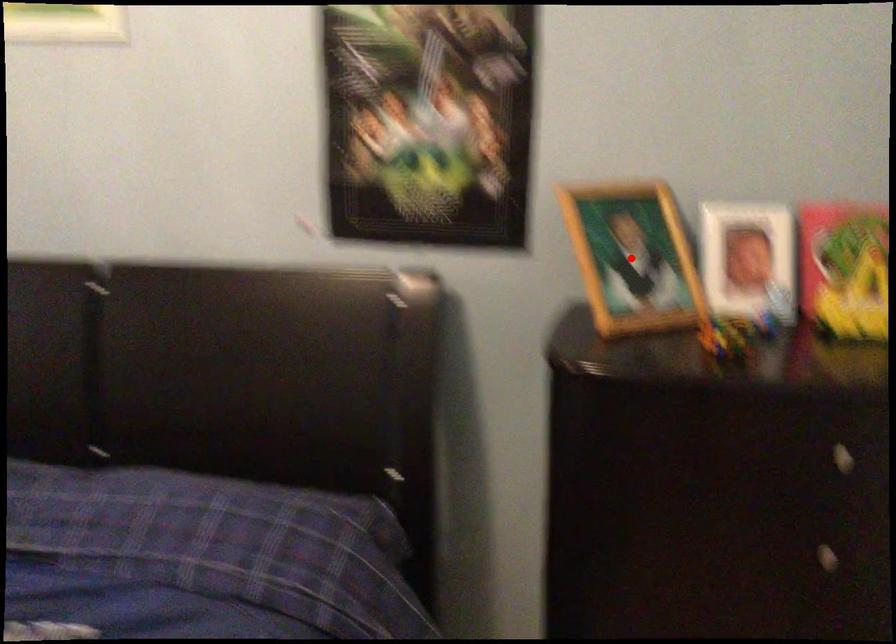
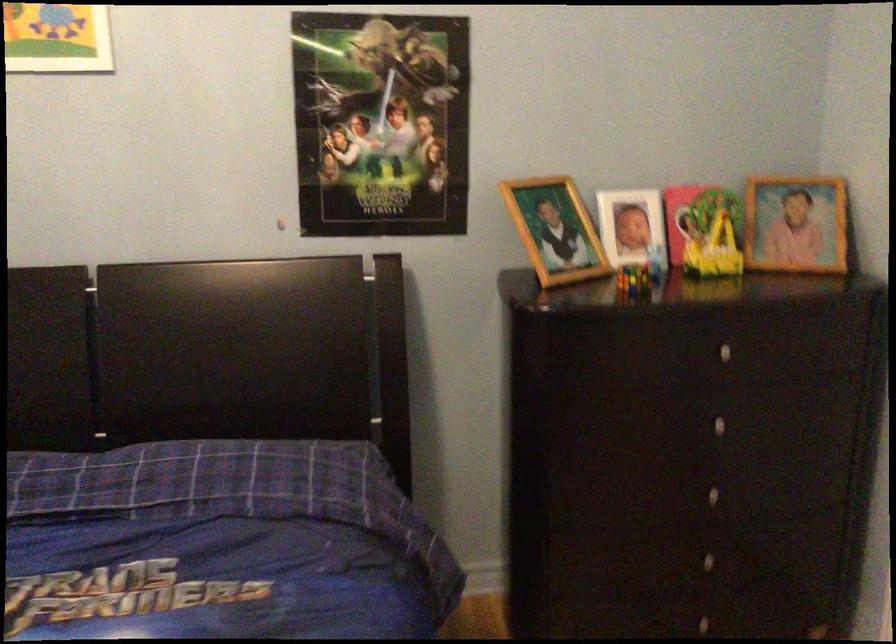
Find the pixel in the second image that matches the highlighted location in the first image.

(555, 230)